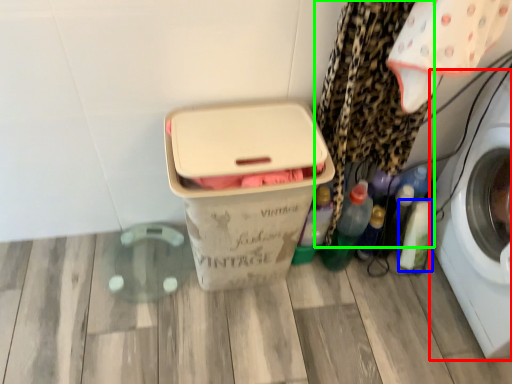
Question: Which is nearer to the washing machine (highlighted by a red box)? bottle (highlighted by a blue box) or curtain (highlighted by a green box).

Choices:
 (A) bottle
 (B) curtain

Answer: (A)